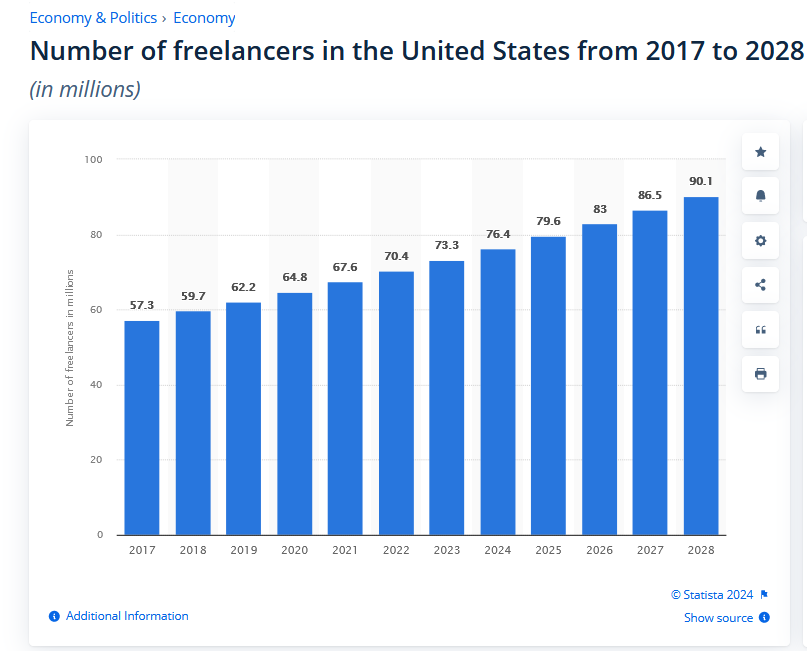
What are the coordinates of `bar` in the screenshot? It's located at (532, 280).